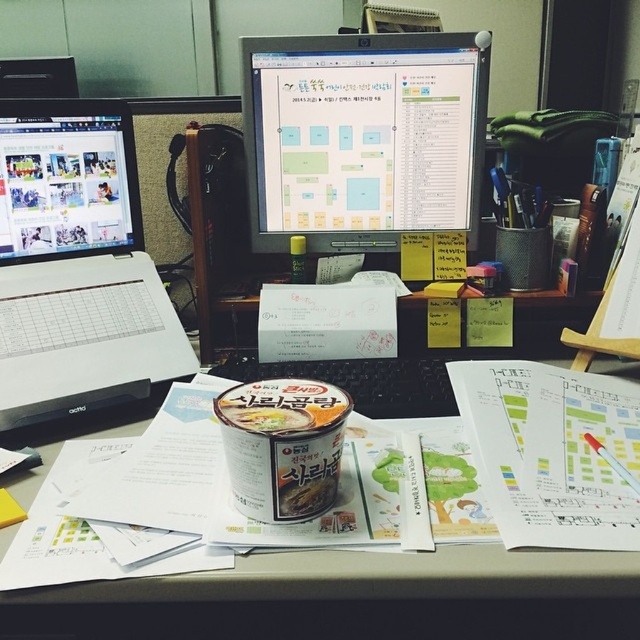
Question: Does matte black monitor at center appear under white plastic laptop at left?

Choices:
 (A) no
 (B) yes

Answer: (A)

Question: Does matte black monitor at center lie behind matte plastic cup at center?

Choices:
 (A) no
 (B) yes

Answer: (B)

Question: Which is nearer to the matte black monitor at center?

Choices:
 (A) matte black laptop at left
 (B) matte plastic cup at center

Answer: (A)

Question: Among these objects, which one is nearest to the camera?

Choices:
 (A) matte black monitor at center
 (B) matte plastic cup at center
 (C) matte black laptop at left

Answer: (B)

Question: Is matte black monitor at center to the right of matte plastic cup at center from the viewer's perspective?

Choices:
 (A) no
 (B) yes

Answer: (B)

Question: Which object is farther from the camera taking this photo?

Choices:
 (A) matte black monitor at center
 (B) white plastic laptop at left

Answer: (A)